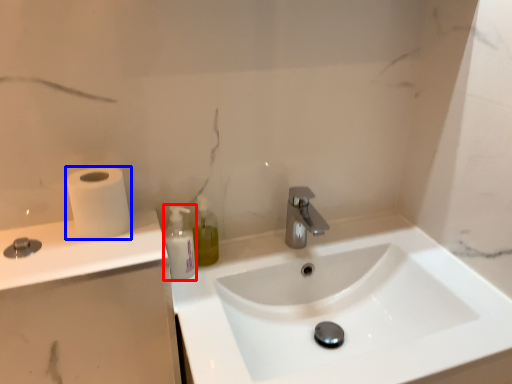
Question: Which of the following is the farthest to the observer, mouthwash (highlighted by a red box) or toilet paper (highlighted by a blue box)?

Choices:
 (A) mouthwash
 (B) toilet paper

Answer: (A)